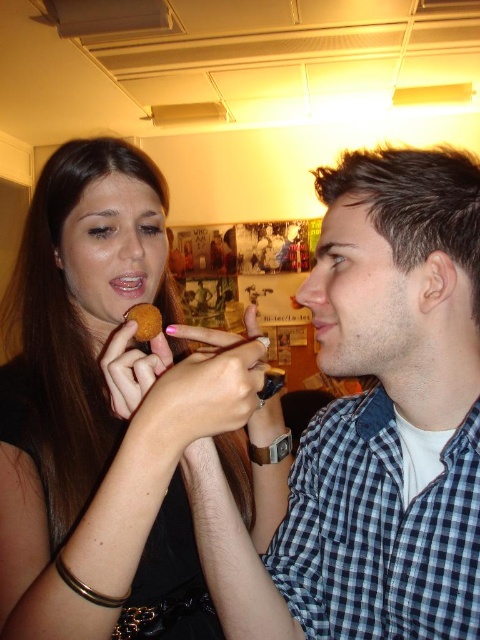
Question: Which point is closer to the camera taking this photo?

Choices:
 (A) (158, 326)
 (B) (421, 570)

Answer: (B)

Question: Which object appears closest to the camera in this image?

Choices:
 (A) matte brown cookie at center
 (B) matte pink lips at center
 (C) checkered fabric shirt at center

Answer: (A)

Question: Which of the following is the closest to the observer?

Choices:
 (A) pink matte lipstick at mouth right
 (B) matte pink lips at center
 (C) matte brown cookie at center
 (D) checkered fabric shirt at center

Answer: (C)

Question: Does golden matte cookie at center appear under matte pink lips at center?

Choices:
 (A) yes
 (B) no

Answer: (A)

Question: Does golden matte cookie at center appear over matte pink lips at center?

Choices:
 (A) yes
 (B) no

Answer: (B)

Question: In this image, where is matte brown cookie at center located relative to pink matte lipstick at mouth right?

Choices:
 (A) above
 (B) below

Answer: (B)